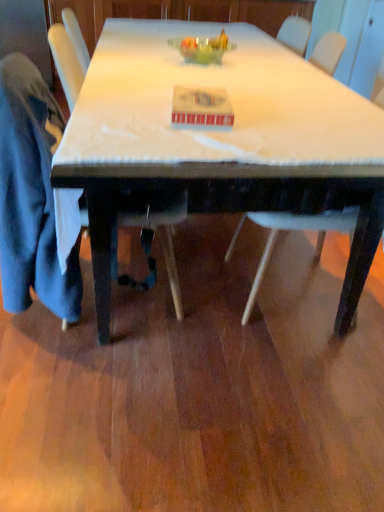
At what (x,y) coordinates should I click in order to perform the action: click on vacant space situated on the left part of translucent glass bowl at center. Please return your answer as a coordinate pair (x, y). Looking at the image, I should click on (141, 58).